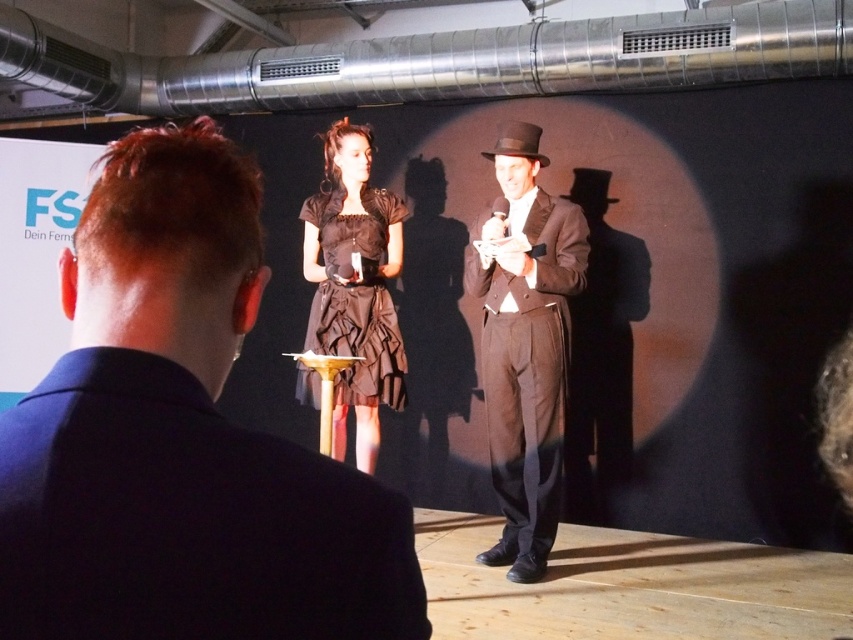
From the picture: Can you confirm if shiny brown suit at center is bigger than black satin dress at center?

Indeed, shiny brown suit at center has a larger size compared to black satin dress at center.

Who is positioned more to the right, shiny brown suit at center or black satin dress at center?

Positioned to the right is shiny brown suit at center.

You are a GUI agent. You are given a task and a screenshot of the screen. Output one action in this format:
    pyautogui.click(x=<x>, y=<y>)
    Task: Click on the shiny brown suit at center
    The image size is (853, 640).
    Given the screenshot: What is the action you would take?
    pyautogui.click(x=525, y=344)

Which is below, matte black suit at center or black felt dress hat at center?

Positioned lower is matte black suit at center.

Which is behind, point (218, 560) or point (524, 134)?

Positioned behind is point (524, 134).

Locate an element on the screen. matte black suit at center is located at coordinates (181, 438).

Does matte black suit at center appear under shiny brown suit at center?

Actually, matte black suit at center is above shiny brown suit at center.

Is matte black suit at center positioned in front of shiny brown suit at center?

That is True.

Which is behind, point (24, 513) or point (552, 358)?

Point (552, 358)

Locate an element on the screen. The width and height of the screenshot is (853, 640). matte black suit at center is located at coordinates (181, 438).